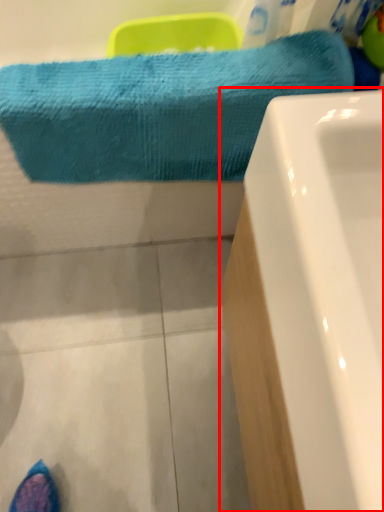
Question: Considering the relative positions of bathtub (annotated by the red box) and towel in the image provided, where is bathtub (annotated by the red box) located with respect to the staircase?

Choices:
 (A) left
 (B) right

Answer: (B)